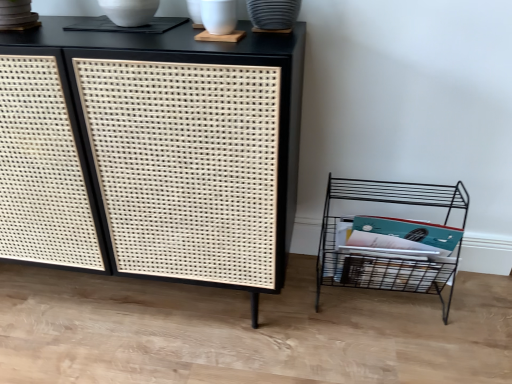
The image size is (512, 384). In order to click on free space that is to the left of black wire shelf at lower right in this screenshot , I will do `click(284, 319)`.